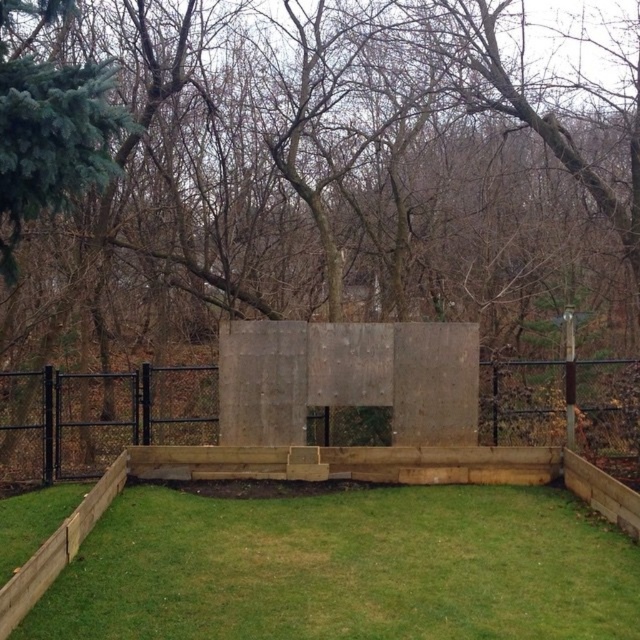
Question: Can you confirm if green leafy tree at center is positioned below brown wood fence at center?

Choices:
 (A) no
 (B) yes

Answer: (A)

Question: Does green grass at lower center appear on the left side of brown wood fence at center?

Choices:
 (A) yes
 (B) no

Answer: (B)

Question: From the image, what is the correct spatial relationship of green leafy tree at center in relation to green grass at lower center?

Choices:
 (A) left
 (B) right

Answer: (B)

Question: Considering the real-world distances, which object is farthest from the green leafy tree at center?

Choices:
 (A) green grass at lower center
 (B) brown wood fence at center

Answer: (A)

Question: Considering the real-world distances, which object is farthest from the green grass at lower center?

Choices:
 (A) brown wood fence at center
 (B) green leafy tree at center

Answer: (B)

Question: Which object is farther from the camera taking this photo?

Choices:
 (A) green grass at lower center
 (B) brown wood fence at center

Answer: (B)